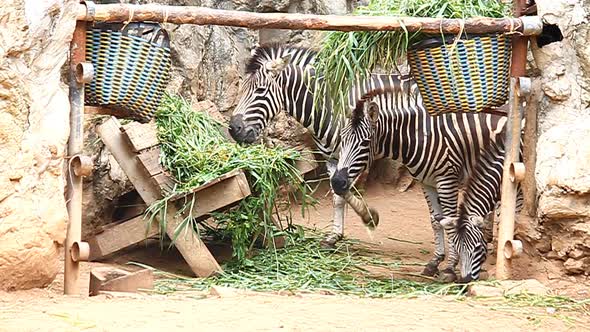
Where is `wooden bench`? This screenshot has height=332, width=590. wooden bench is located at coordinates (155, 165).